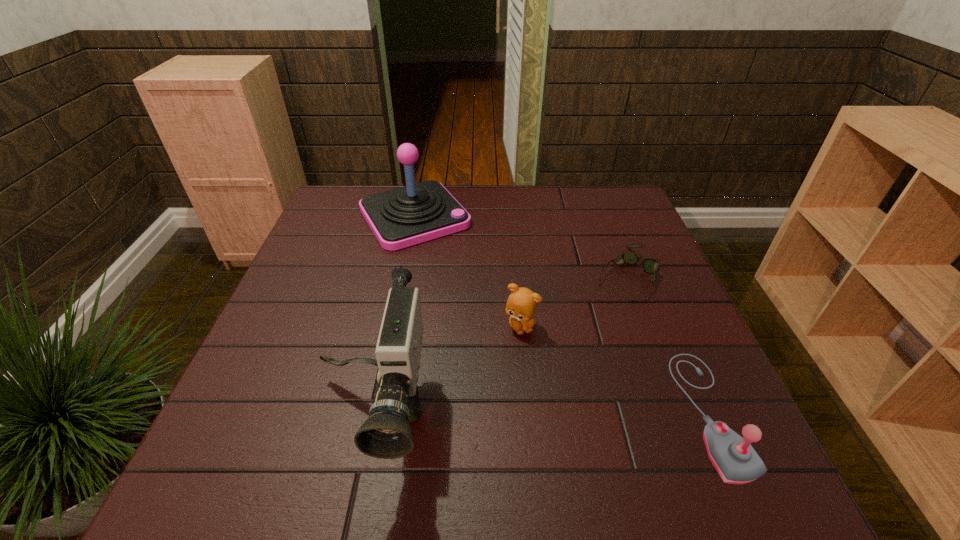
Identify the location of free space at the right edge of the desktop. Image resolution: width=960 pixels, height=540 pixels. (667, 322).

This screenshot has width=960, height=540. In order to click on vacant space at the far left corner of the desktop in this screenshot , I will do `click(350, 201)`.

I want to click on free location at the far right corner, so click(597, 190).

Identify the location of vacant space that's between the right joystick and the teddy bear. The width and height of the screenshot is (960, 540). (615, 369).

This screenshot has width=960, height=540. I want to click on free space that is in between the spectacles and the right joystick, so click(668, 344).

Where is `free spot between the right joystick and the shortest object`? free spot between the right joystick and the shortest object is located at coordinates (668, 344).

Locate an element on the screen. This screenshot has height=540, width=960. free space between the spectacles and the taller joystick is located at coordinates (520, 246).

The width and height of the screenshot is (960, 540). In order to click on unoccupied position between the third object from right to left and the shorter joystick in this screenshot , I will do [615, 369].

Where is `free space that is in between the second farthest object and the nearer joystick`? This screenshot has width=960, height=540. free space that is in between the second farthest object and the nearer joystick is located at coordinates (668, 344).

This screenshot has height=540, width=960. In order to click on empty space between the right joystick and the camcorder in this screenshot , I will do `click(540, 413)`.